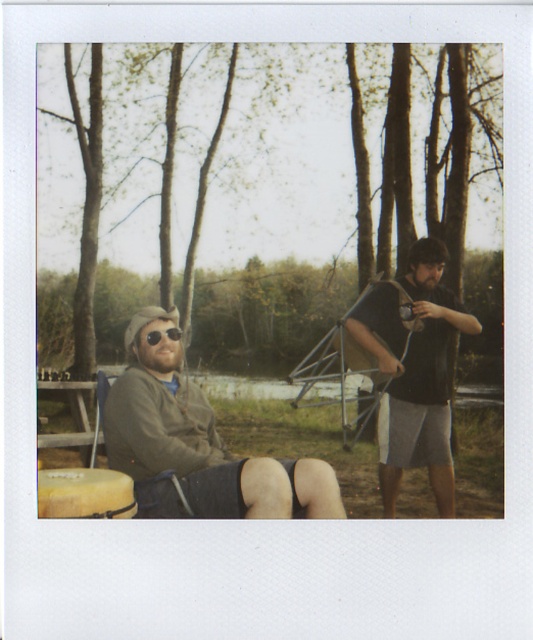
You are standing at the camera position and see two points in the scene. The first point is at coordinates point (179, 374) and the second point is at point (91, 385). Which point is closer to you?

Point (179, 374) is in front of point (91, 385), so the first point is closer to you.

You are standing at the center of the image and want to place a new bench exactly 0.5 meters to the right of the wooden picnic table at lower left. Where should you place the bench?

The wooden picnic table at lower left is located at point [72,419]. To place the bench 0.5 meters to the right, you would position it at point 0.655 plus 0.5 meters in the x coordinate, resulting in [72,639].

From the picture: You are a photographer trying to capture a candid shot of the two people in the scene. You notice the matte gray jacket at left and the matte black shirt at right. Which clothing item should you focus on first if you want to ensure both are in sharp focus?

The matte gray jacket at left is closer to the viewer than the matte black shirt at right. To ensure both are in sharp focus, focus on the matte gray jacket at left first, as it is the closer object.